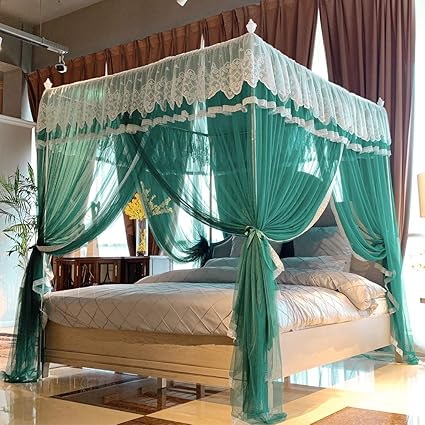
You are a GUI agent. You are given a task and a screenshot of the screen. Output one action in this format:
    pyautogui.click(x=<x>, y=<y>)
    Task: Click on the wall
    
    Given the screenshot: What is the action you would take?
    pyautogui.click(x=129, y=19)